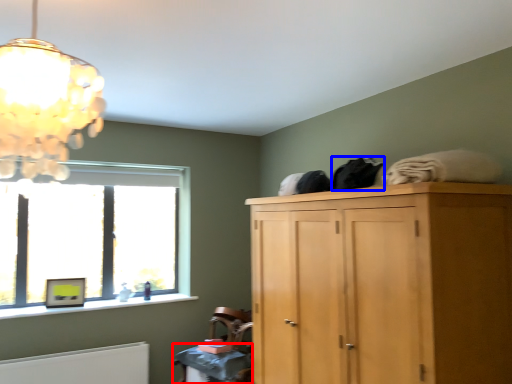
Question: Which object is closer to the camera taking this photo, table (highlighted by a red box) or clothing (highlighted by a blue box)?

Choices:
 (A) table
 (B) clothing

Answer: (B)